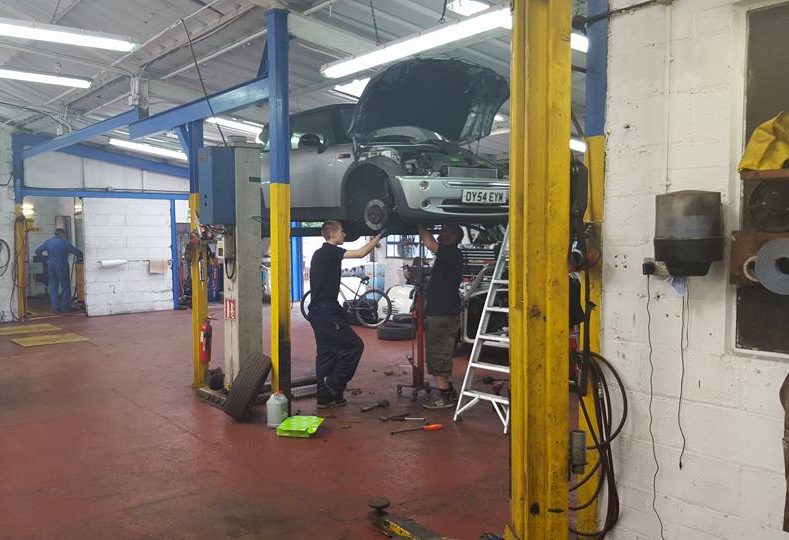
Identify the location of white concrete block wall. (125, 228).